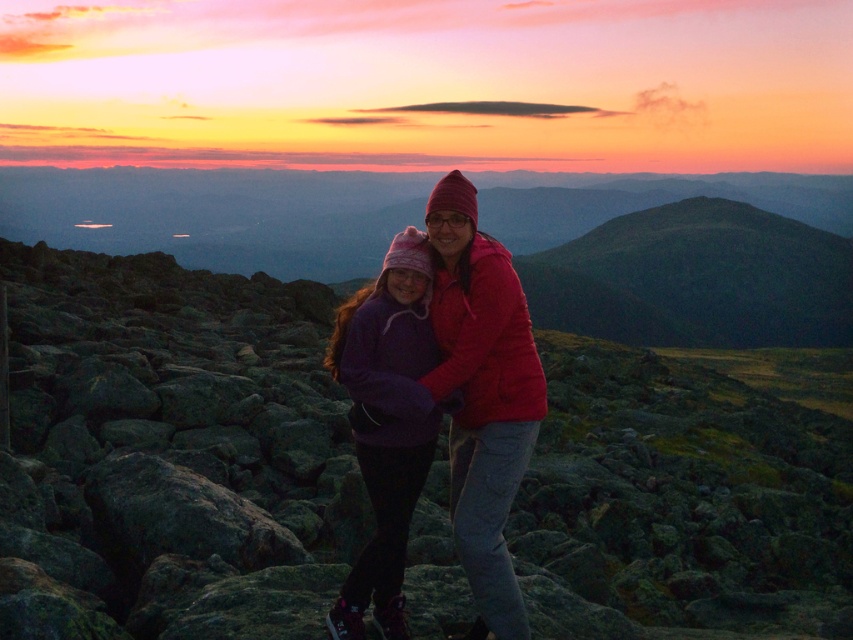
Which is more to the right, green grassy hill at center or matte pink hat at center?

green grassy hill at center

Which is below, green grassy hill at center or matte pink hat at center?

matte pink hat at center is lower down.

The height and width of the screenshot is (640, 853). What do you see at coordinates (695, 278) in the screenshot?
I see `green grassy hill at center` at bounding box center [695, 278].

Find the location of a particular element. green grassy hill at center is located at coordinates (695, 278).

Can you confirm if rocky terrain at center is bigger than matte pink hat at center?

Yes.

Does rocky terrain at center have a greater width compared to matte pink hat at center?

Yes.

Between point (79, 440) and point (492, 396), which one is positioned behind?

The point (79, 440) is more distant.

You are a GUI agent. You are given a task and a screenshot of the screen. Output one action in this format:
    pyautogui.click(x=<x>, y=<y>)
    Task: Click on the rocky terrain at center
    
    Given the screenshot: What is the action you would take?
    pyautogui.click(x=170, y=452)

In the scene shown: Is rocky terrain at center closer to camera compared to green grassy hill at center?

Yes, rocky terrain at center is closer to the viewer.

Does point (299, 474) come behind point (741, 236)?

No, (299, 474) is in front of (741, 236).

In order to click on rocky terrain at center in this screenshot , I will do `click(170, 452)`.